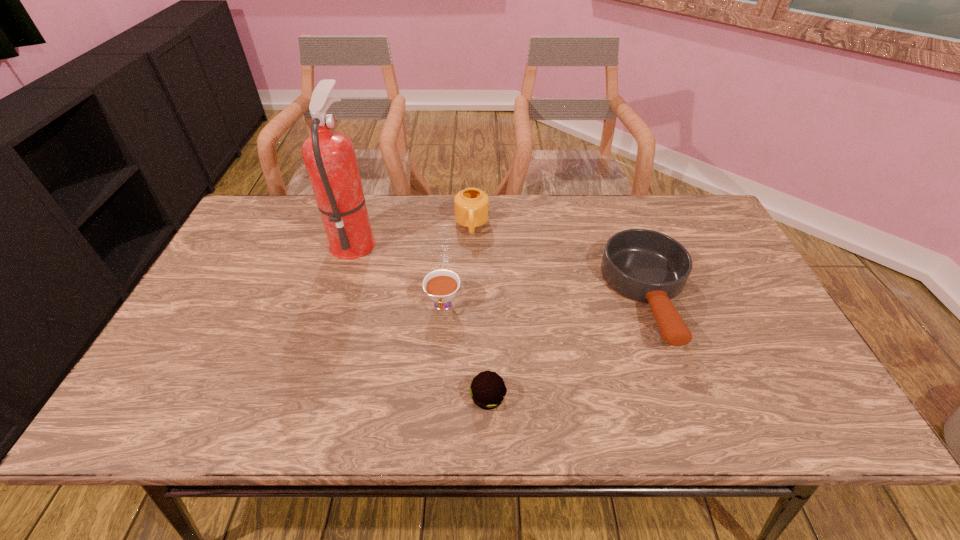
In order to click on vacant region located 0.160m on the side of the teacup with the handle in this screenshot , I will do `click(438, 377)`.

Find the location of a particular element. The image size is (960, 540). free spot located 0.270m on the back of the nearest object is located at coordinates (487, 293).

Where is `fire extinguisher located at the far edge`? This screenshot has height=540, width=960. fire extinguisher located at the far edge is located at coordinates (329, 156).

Identify the location of mug located in the far edge section of the desktop. (471, 205).

You are a GUI agent. You are given a task and a screenshot of the screen. Output one action in this format:
    pyautogui.click(x=<x>, y=<y>)
    Task: Click on the object present at the near edge
    
    Given the screenshot: What is the action you would take?
    pyautogui.click(x=487, y=389)

In order to click on vacant space at the far edge of the desktop in this screenshot , I will do `click(550, 196)`.

Locate an element on the screen. The width and height of the screenshot is (960, 540). vacant space at the near edge is located at coordinates (220, 425).

What are the coordinates of `free space at the left edge` in the screenshot? It's located at point(231,265).

You are a GUI agent. You are given a task and a screenshot of the screen. Output one action in this format:
    pyautogui.click(x=<x>, y=<y>)
    Task: Click on the vacant position at the right edge of the desktop
    
    Given the screenshot: What is the action you would take?
    (747, 275)

In the image, there is a desktop. Where is `free space at the far left corner`? This screenshot has height=540, width=960. free space at the far left corner is located at coordinates (257, 238).